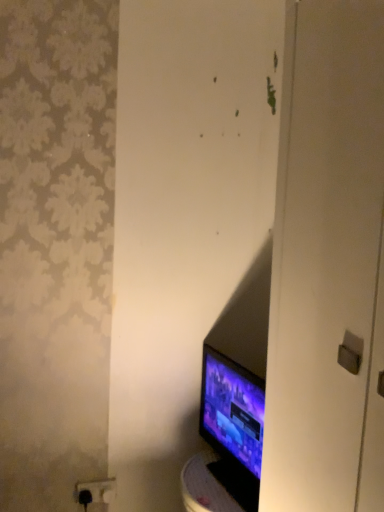
Question: Can you confirm if matte black monitor at lower right is positioned to the right of black plastic outlet at lower left?

Choices:
 (A) yes
 (B) no

Answer: (A)

Question: Is matte black monitor at lower right bigger than black plastic outlet at lower left?

Choices:
 (A) yes
 (B) no

Answer: (A)

Question: From the image's perspective, is matte black monitor at lower right on top of black plastic outlet at lower left?

Choices:
 (A) yes
 (B) no

Answer: (A)

Question: Could you tell me if matte black monitor at lower right is turned towards black plastic outlet at lower left?

Choices:
 (A) yes
 (B) no

Answer: (B)

Question: Considering the relative sizes of matte black monitor at lower right and black plastic outlet at lower left in the image provided, is matte black monitor at lower right smaller than black plastic outlet at lower left?

Choices:
 (A) yes
 (B) no

Answer: (B)

Question: Is matte black monitor at lower right in front of black plastic outlet at lower left?

Choices:
 (A) no
 (B) yes

Answer: (B)

Question: Is black plastic outlet at lower left not within matte black monitor at lower right?

Choices:
 (A) yes
 (B) no

Answer: (A)

Question: From the image's perspective, is black plastic outlet at lower left on matte black monitor at lower right?

Choices:
 (A) yes
 (B) no

Answer: (B)

Question: From the image's perspective, is black plastic outlet at lower left beneath matte black monitor at lower right?

Choices:
 (A) yes
 (B) no

Answer: (A)

Question: Would you say black plastic outlet at lower left is a long distance from matte black monitor at lower right?

Choices:
 (A) no
 (B) yes

Answer: (A)

Question: From a real-world perspective, is black plastic outlet at lower left physically below matte black monitor at lower right?

Choices:
 (A) yes
 (B) no

Answer: (A)

Question: Can you confirm if black plastic outlet at lower left is positioned to the left of matte black monitor at lower right?

Choices:
 (A) no
 (B) yes

Answer: (B)

Question: Considering the positions of matte black monitor at lower right and black plastic outlet at lower left in the image, is matte black monitor at lower right bigger or smaller than black plastic outlet at lower left?

Choices:
 (A) small
 (B) big

Answer: (B)